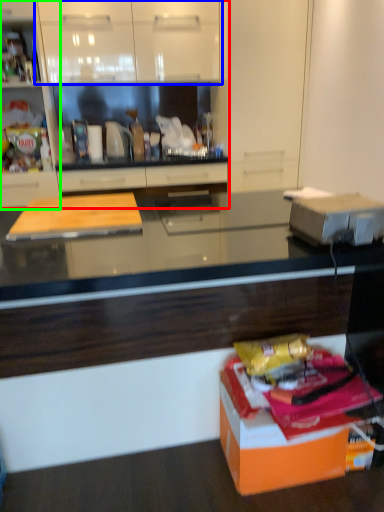
Question: Based on their relative distances, which object is nearer to cabinetry (highlighted by a red box)? Choose from cabinetry (highlighted by a blue box) and cabinetry (highlighted by a green box).

Choices:
 (A) cabinetry
 (B) cabinetry

Answer: (A)